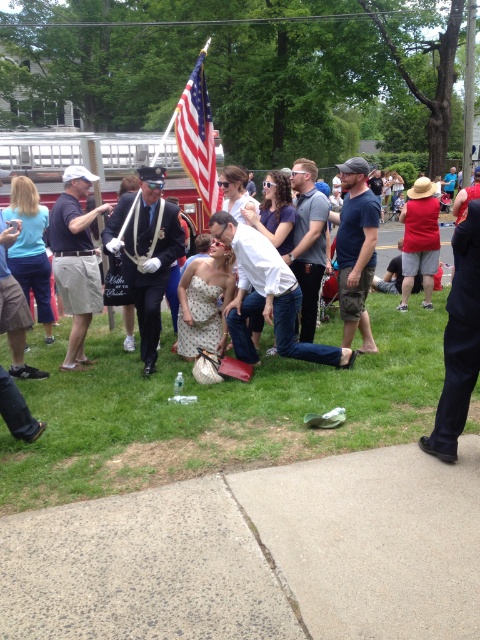
Is dark blue t-shirt at center wider than american flag at center?

In fact, dark blue t-shirt at center might be narrower than american flag at center.

What do you see at coordinates (356, 250) in the screenshot? The height and width of the screenshot is (640, 480). I see `dark blue t-shirt at center` at bounding box center [356, 250].

This screenshot has height=640, width=480. In order to click on dark blue t-shirt at center in this screenshot , I will do `click(356, 250)`.

Which is more to the right, dark blue jeans at right or dark blue t-shirt at center?

Positioned to the right is dark blue jeans at right.

Who is more distant from viewer, (444, 404) or (358, 280)?

Positioned behind is point (358, 280).

Is point (444, 349) closer to camera compared to point (352, 243)?

Yes, it is in front of point (352, 243).

You are a GUI agent. You are given a task and a screenshot of the screen. Output one action in this format:
    pyautogui.click(x=<x>, y=<y>)
    Task: Click on the dark blue jeans at right
    
    Given the screenshot: What is the action you would take?
    pyautogui.click(x=458, y=340)

What do you see at coordinates (146, 253) in the screenshot? I see `shiny black suit at center` at bounding box center [146, 253].

Is point (143, 288) less distant than point (463, 236)?

No, (143, 288) is behind (463, 236).

This screenshot has width=480, height=640. Identify the location of shiny black suit at center. (146, 253).